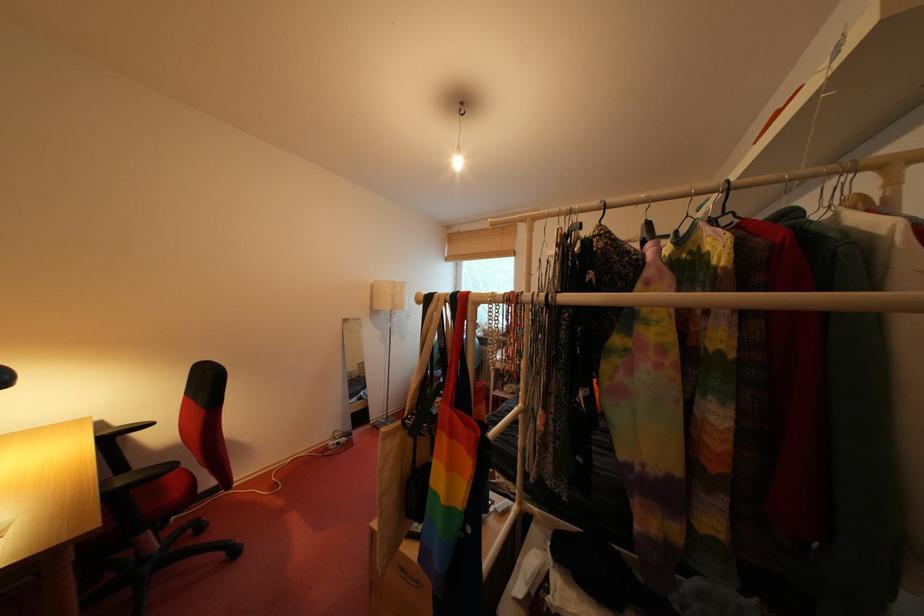
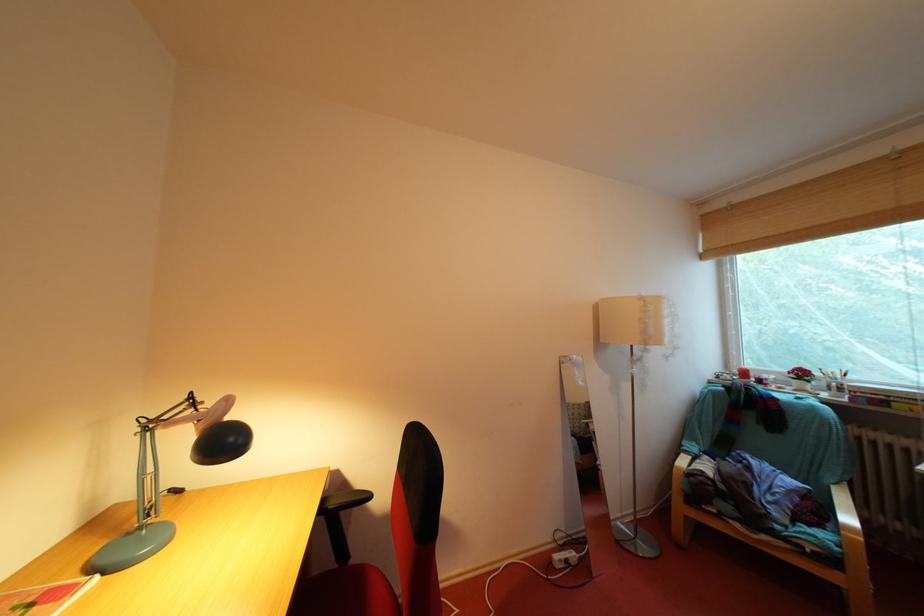
Question: The images are taken continuously from a first-person perspective. In which direction is your viewpoint rotating?

Choices:
 (A) Left
 (B) Right
 (C) Up
 (D) Down

Answer: (A)